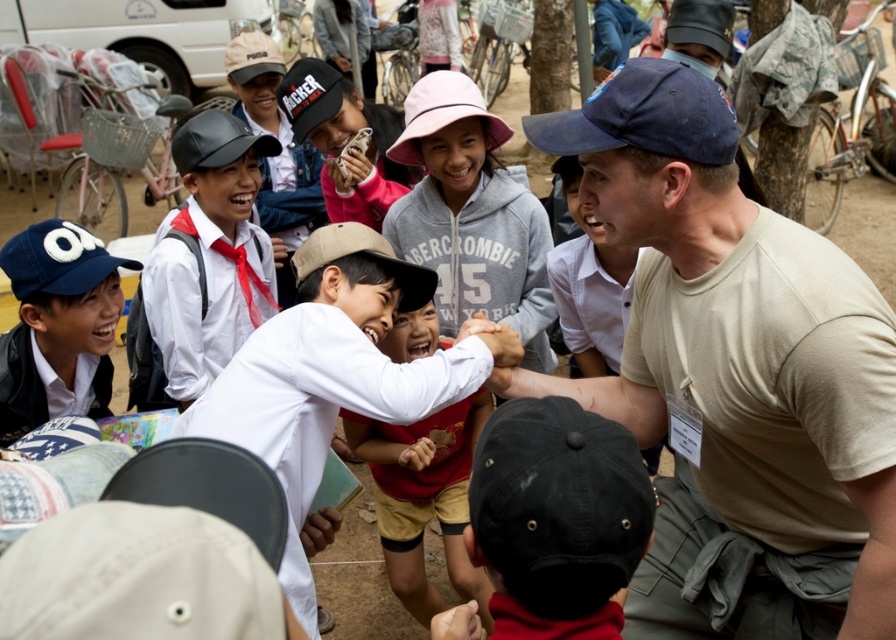
Question: Which object is the closest to the tan fabric baseball cap at center?

Choices:
 (A) white cotton shirt at center
 (B) denim baseball cap at left
 (C) black matte baseball cap at lower center
 (D) white matte cap at left

Answer: (A)

Question: Based on their relative distances, which object is farther from the white matte shirt at center?

Choices:
 (A) white cotton shirt at center
 (B) blue fabric baseball cap at upper center
 (C) pink fabric hat at center
 (D) beige cotton t-shirt at center

Answer: (D)

Question: Is red cotton shirt at center closer to camera compared to denim baseball cap at left?

Choices:
 (A) no
 (B) yes

Answer: (A)

Question: Observing the image, what is the correct spatial positioning of beige cotton t-shirt at center in reference to denim baseball cap at left?

Choices:
 (A) above
 (B) below

Answer: (B)

Question: Estimate the real-world distances between objects in this image. Which object is closer to the black leather baseball cap at upper left?

Choices:
 (A) blue fabric baseball cap at upper center
 (B) tan fabric baseball cap at center
 (C) white matte cap at left

Answer: (C)

Question: Can you confirm if white matte cap at left is thinner than black leather baseball cap at upper left?

Choices:
 (A) no
 (B) yes

Answer: (B)